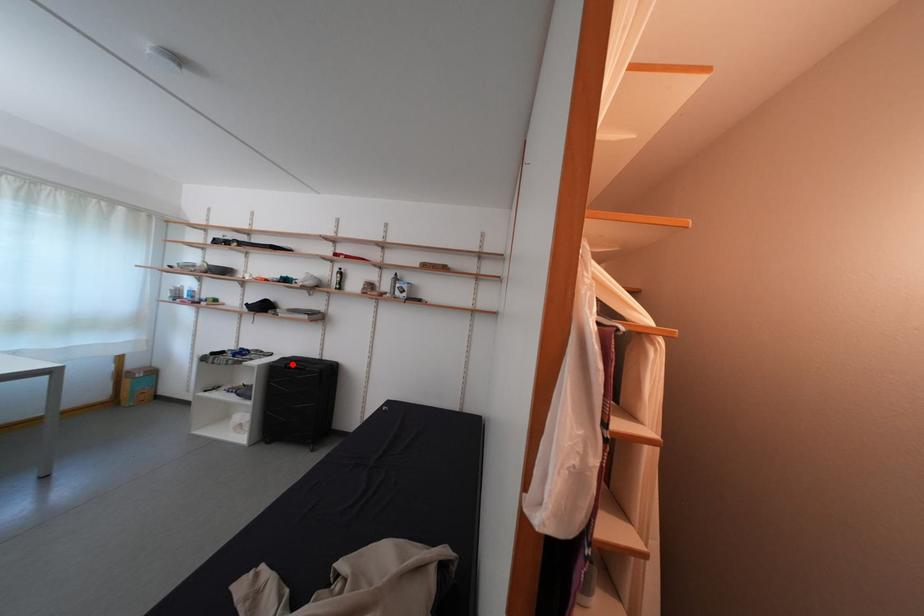
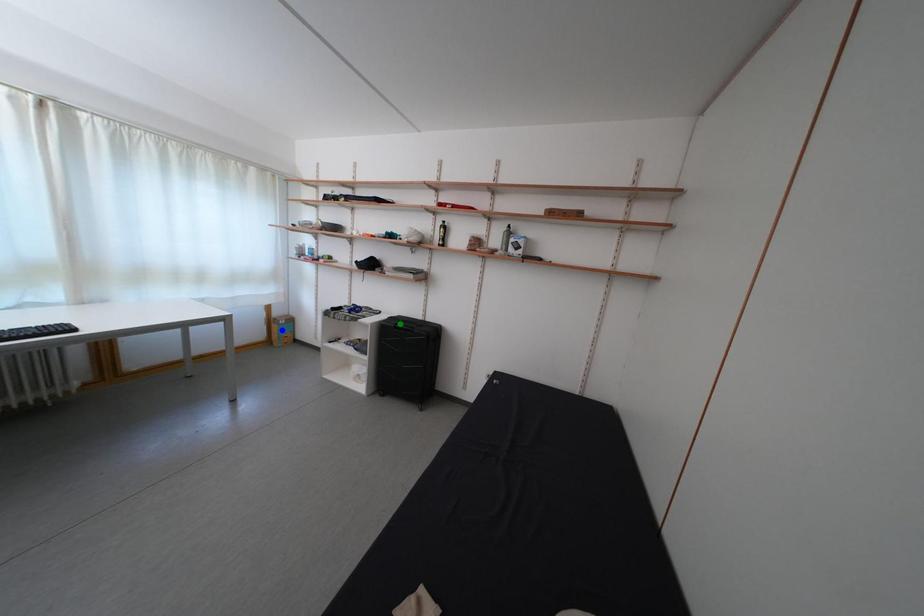
Question: I am providing you with two images of the same scene from different viewpoints. A red point is marked on the first image. You are given multiple points on the second image. Which spot in image 2 lines up with the point in image 1?

Choices:
 (A) green point
 (B) yellow point
 (C) blue point

Answer: (A)